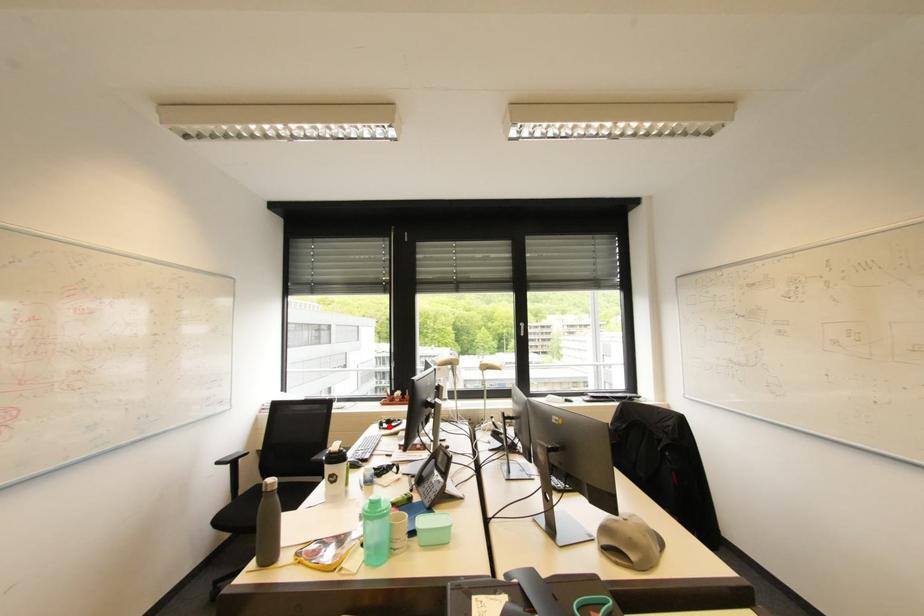
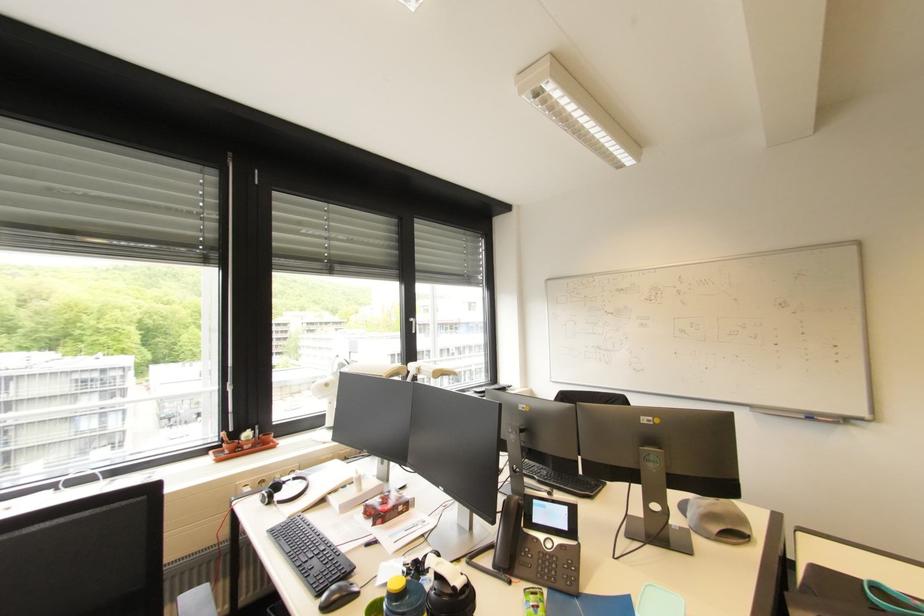
Question: I am providing you with two images of the same scene from different viewpoints. A red point is marked on the first image. At the location where the point appears in image 1, is it still visible in image 2?

Choices:
 (A) Yes
 (B) No

Answer: (A)